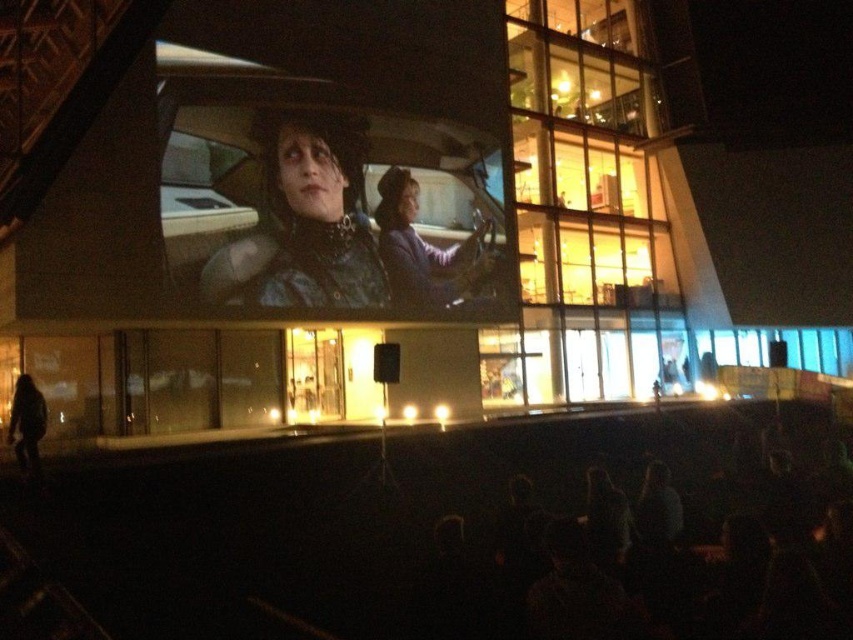
You are a photographer standing at the location where the image was taken. You want to capture a photo of the matte black leather car at center without any obstructions. Is the distance sufficient for a clear shot using a standard camera lens with a maximum focal length of 200mm?

The matte black leather car at center is 30.10 meters away from the camera. A standard camera lens with a maximum focal length of 200mm can effectively capture clear shots from distances up to approximately 30 meters. Therefore, the distance is sufficient for a clear shot without obstructions.

You are an event planner organizing a movie night at the building with the projection screen. You need to decide whether the matte black leather car at center can fit inside the building if the purple fabric jacket at center is already occupying space in the entrance. Based on their sizes, what should you consider?

The matte black leather car at center is larger in size than the purple fabric jacket at center. Therefore, if the purple fabric jacket at center is already in the entrance, the matte black leather car at center may not fit due to its larger size.

You are an event organizer setting up a movie night. You need to place a matte black leather car at center and a leather jacket at center in front of the projection screen. Since the screen shows a fantasy movie scene, which object should you place closer to the screen to maintain the movie theme? Please choose between the two objects.

The matte black leather car at center is larger in size than the leather jacket at center, so to maintain the movie theme, the larger matte black leather car at center should be placed closer to the screen to emphasize its prominence in the scene.